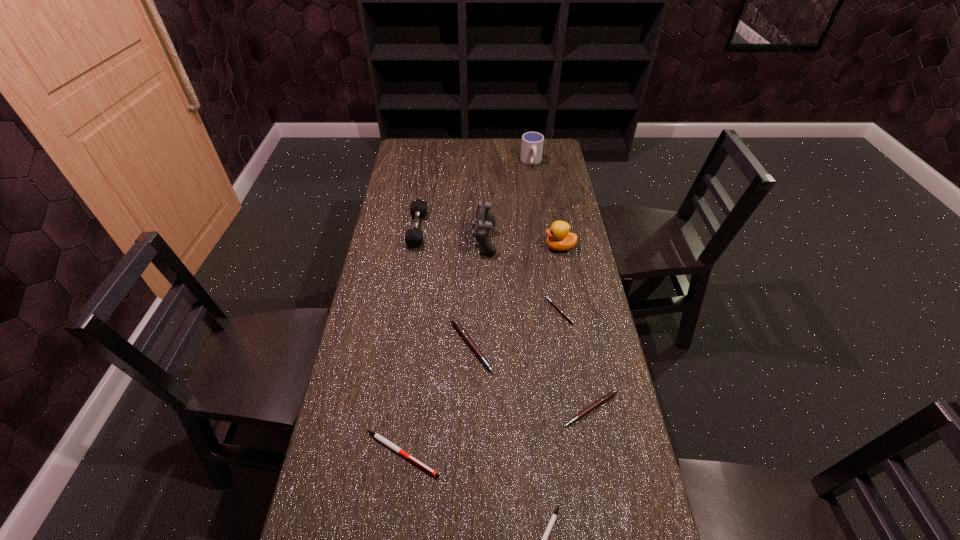
Image resolution: width=960 pixels, height=540 pixels. I want to click on control, so click(485, 221).

Locate an element on the screen. This screenshot has height=540, width=960. cup is located at coordinates (532, 142).

Where is `yellow duckling`? The image size is (960, 540). yellow duckling is located at coordinates (559, 238).

Where is `the sixth shortest object`? Image resolution: width=960 pixels, height=540 pixels. the sixth shortest object is located at coordinates (414, 237).

This screenshot has width=960, height=540. I want to click on the leftmost pink pen, so click(x=459, y=328).

This screenshot has height=540, width=960. Find the location of `the fifth shortest object`. the fifth shortest object is located at coordinates (459, 328).

Where is `the seventh farthest object`? This screenshot has height=540, width=960. the seventh farthest object is located at coordinates pos(605,398).

You are a GUI agent. You are given a task and a screenshot of the screen. Output one action in this format:
    pyautogui.click(x=<x>, y=<y>)
    Task: Click on the second smallest pink pen
    
    Given the screenshot: What is the action you would take?
    pyautogui.click(x=605, y=398)

You are a GUI agent. You are given a task and a screenshot of the screen. Output one action in this format:
    pyautogui.click(x=<x>, y=<y>)
    Task: Click on the second nearest object
    
    Given the screenshot: What is the action you would take?
    pyautogui.click(x=383, y=440)

The image size is (960, 540). Find the location of `the left white pen`. the left white pen is located at coordinates (383, 440).